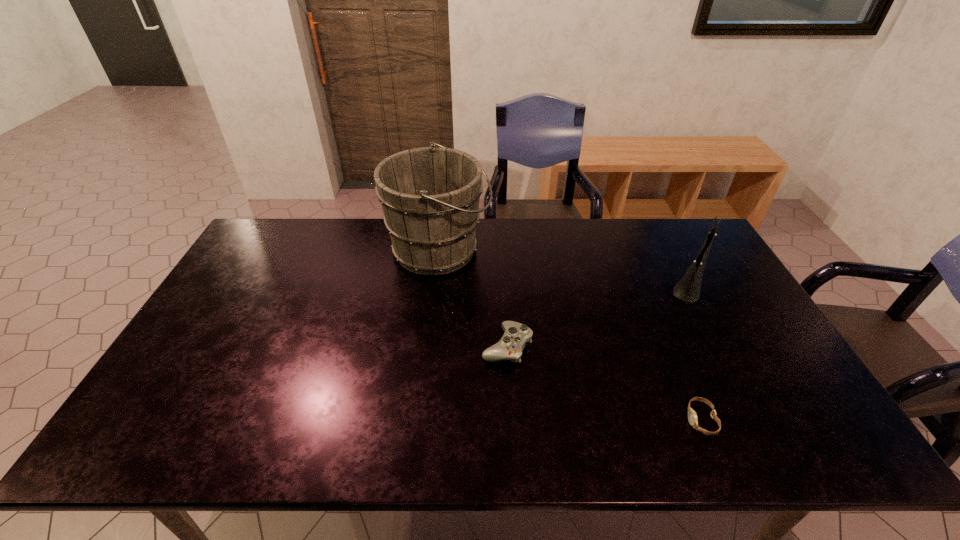
Identify the location of unoccupied area between the shortest object and the control. The height and width of the screenshot is (540, 960). (604, 383).

Identify which object is the second closest to the nearest object. Please provide its 2D coordinates. Your answer should be formatted as a tuple, i.e. [(x, y)], where the tuple contains the x and y coordinates of a point satisfying the conditions above.

[(510, 346)]

Locate an element on the screen. This screenshot has width=960, height=540. the second closest object to the watch is located at coordinates (510, 346).

Identify the location of vacant region that satisfies the following two spatial constraints: 1. on the front side of the rightmost object; 2. on the face of the nearest object. (762, 420).

This screenshot has height=540, width=960. I want to click on vacant space that satisfies the following two spatial constraints: 1. on the back side of the third farthest object; 2. on the handle side of the bucket, so (x=501, y=250).

Where is `free location that satisfies the following two spatial constraints: 1. on the handle side of the tallest object; 2. on the left side of the third shortest object`? free location that satisfies the following two spatial constraints: 1. on the handle side of the tallest object; 2. on the left side of the third shortest object is located at coordinates (435, 286).

Locate an element on the screen. vacant region that satisfies the following two spatial constraints: 1. on the back side of the third farthest object; 2. on the handle side of the tallest object is located at coordinates (501, 250).

I want to click on free space in the image that satisfies the following two spatial constraints: 1. on the front side of the third shortest object; 2. on the face of the shortest object, so click(762, 420).

Identify the location of vacant region that satisfies the following two spatial constraints: 1. on the back side of the shoulder bag; 2. on the handle side of the tallest object. Image resolution: width=960 pixels, height=540 pixels. (671, 250).